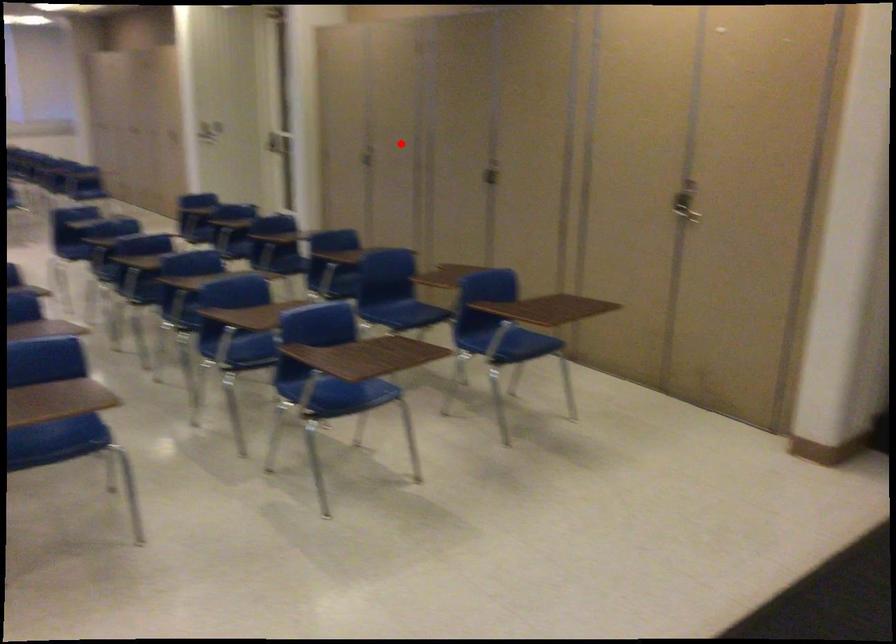
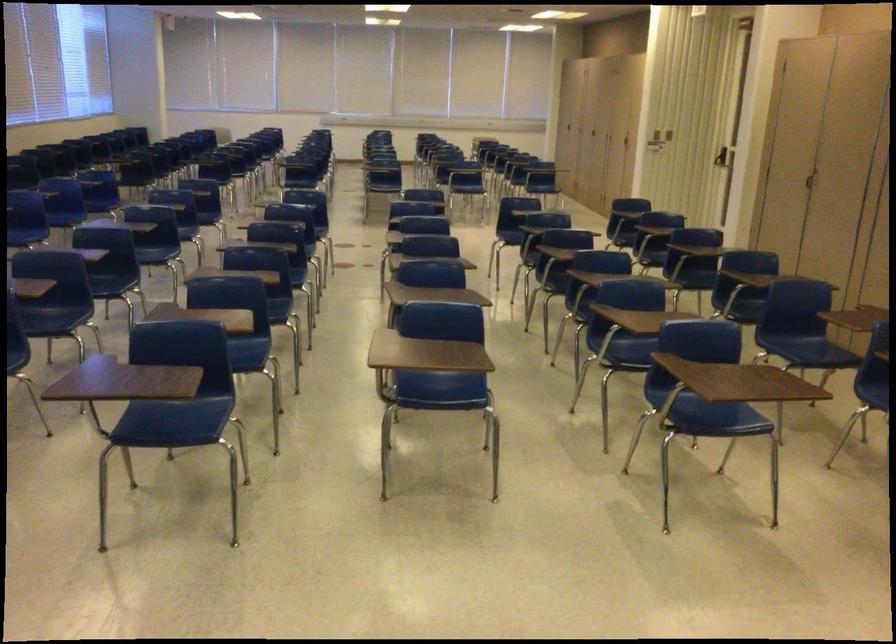
Find the pixel in the second image that matches the highlighted location in the first image.

(853, 173)